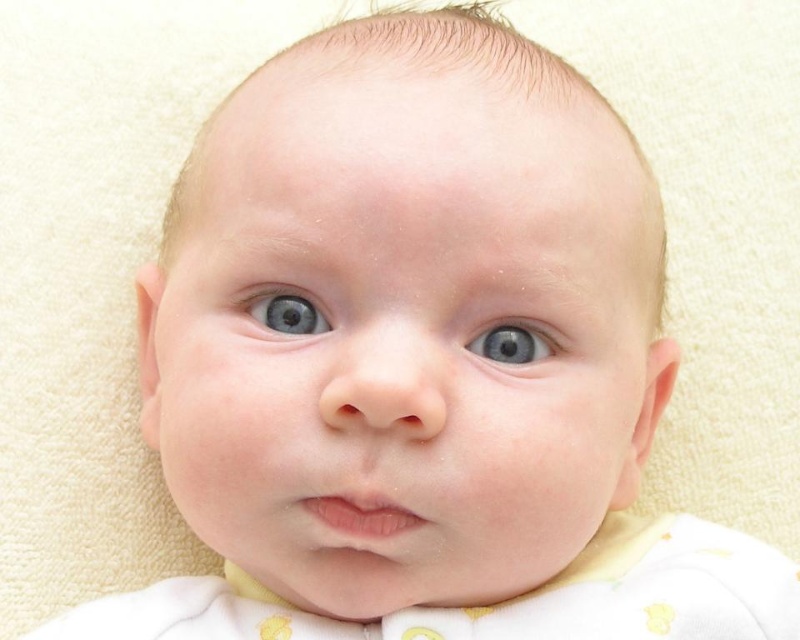
You are a photographer adjusting lighting for a baby photo shoot. You notice the baby has two eyes, a blue smooth eye at center and a blue glossy eye at center. Which eye should you focus on to ensure the lighting highlights the larger feature?

The blue smooth eye at center is larger in size than the blue glossy eye at center, so focusing on the blue smooth eye at center would highlight the larger feature.